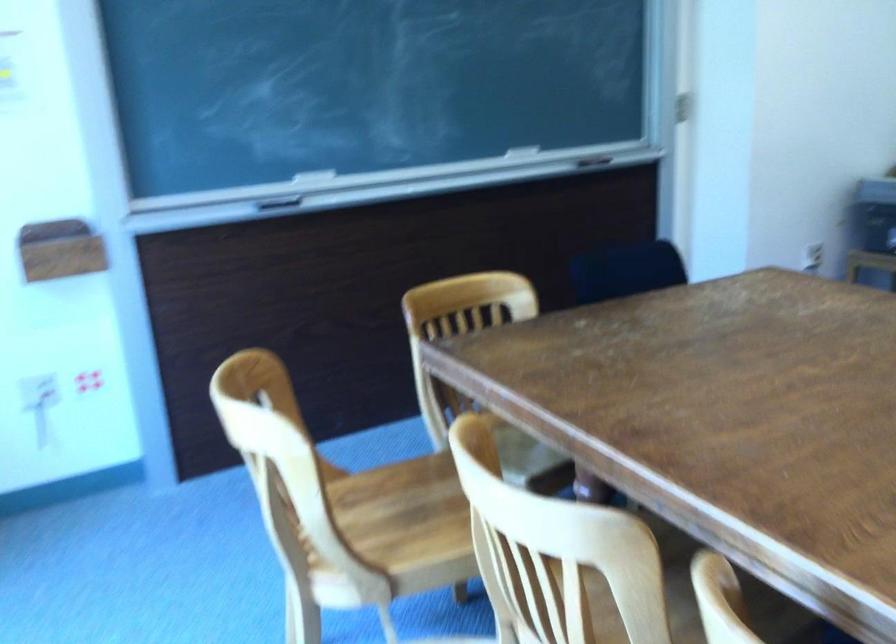
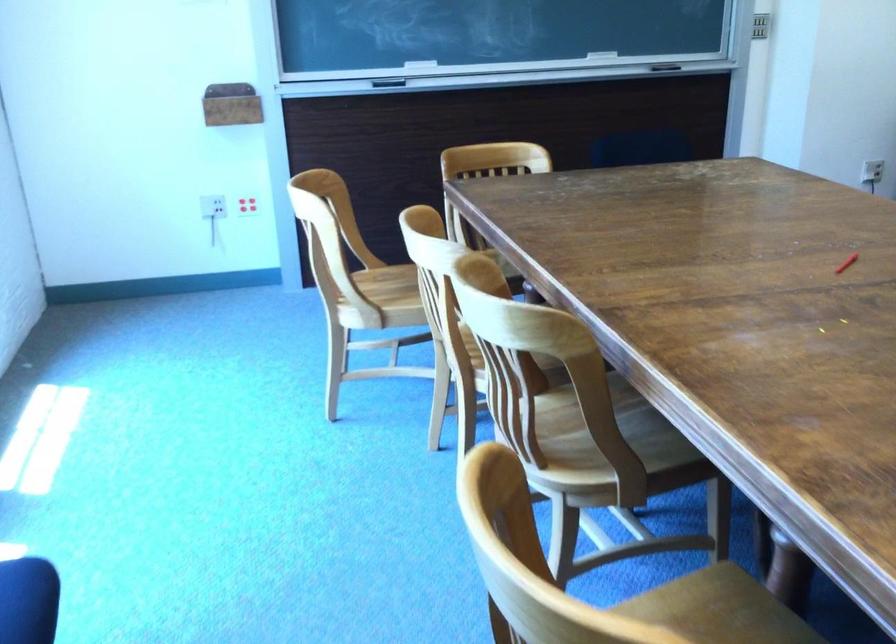
Where in the second image is the point corresponding to pixel 281 526 from the first image?

(328, 276)